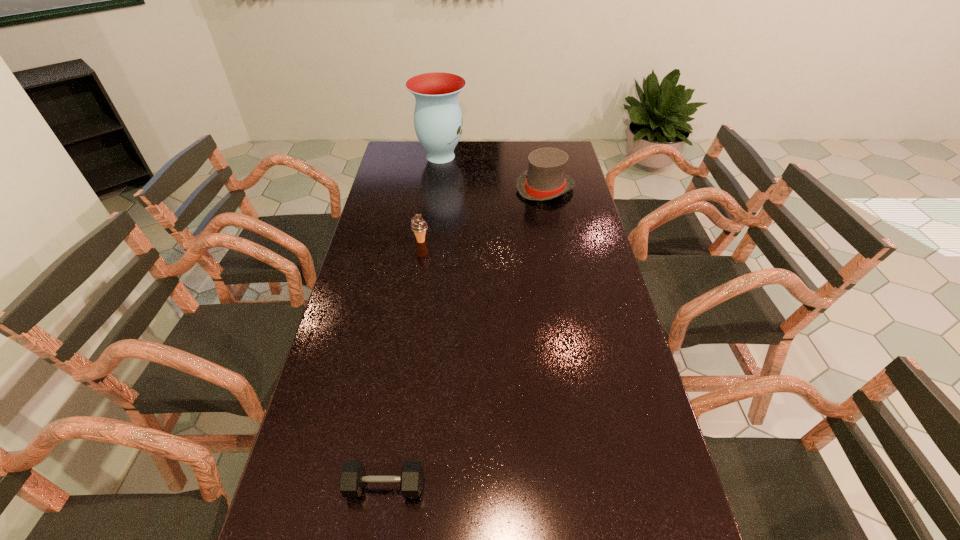
Locate an element on the screen. The image size is (960, 540). vacant space at the far left corner of the desktop is located at coordinates (404, 149).

Identify the location of vacant space at the far right corner of the desktop. (548, 142).

Find the location of a particular element. This screenshot has height=540, width=960. blank region between the rightmost object and the dumbbell is located at coordinates (465, 337).

The width and height of the screenshot is (960, 540). Find the location of `empty space that is in between the third nearest object and the third tallest object`. empty space that is in between the third nearest object and the third tallest object is located at coordinates (x=483, y=215).

The height and width of the screenshot is (540, 960). Find the location of `unoccupied position between the vase and the second farthest object`. unoccupied position between the vase and the second farthest object is located at coordinates (492, 172).

Locate an element on the screen. vacant space that is in between the nearest object and the third tallest object is located at coordinates (403, 363).

You are a GUI agent. You are given a task and a screenshot of the screen. Output one action in this format:
    pyautogui.click(x=<x>, y=<y>)
    Task: Click on the free space between the second nearest object and the tallest object
    The height and width of the screenshot is (540, 960).
    Given the screenshot: What is the action you would take?
    pyautogui.click(x=431, y=199)

At what (x,y) coordinates should I click in order to perform the action: click on free point between the farthest object and the rightmost object. Please return your answer as a coordinate pair (x, y). The image size is (960, 540). Looking at the image, I should click on (492, 172).

Locate an element on the screen. free point between the tallest object and the second nearest object is located at coordinates (431, 199).

Locate an element on the screen. free spot between the third shortest object and the nearest object is located at coordinates (465, 337).